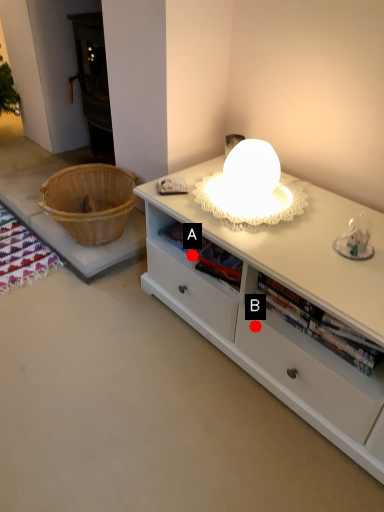
Question: Two points are circled on the image, labeled by A and B beside each circle. Which point is closer to the camera?

Choices:
 (A) A is closer
 (B) B is closer

Answer: (B)